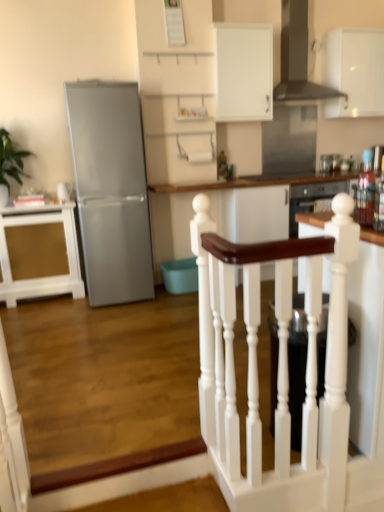
Question: Is the depth of white matte cabinet at upper center, positioned as the 2th cabinetry in left-to-right order, less than that of white matte cabinet at upper right, placed as the first cabinetry when sorted from top to bottom?

Choices:
 (A) yes
 (B) no

Answer: (A)

Question: Is white matte cabinet at upper center, which appears as the second cabinetry when ordered from the bottom, positioned far away from white matte cabinet at upper right, arranged as the third cabinetry when ordered from the bottom?

Choices:
 (A) no
 (B) yes

Answer: (A)

Question: From the image's perspective, does white matte cabinet at upper center, which appears as the second cabinetry when ordered from the bottom, appear higher than white matte cabinet at upper right, placed as the first cabinetry when sorted from right to left?

Choices:
 (A) yes
 (B) no

Answer: (B)

Question: From the image's perspective, does white matte cabinet at upper center, positioned as the 2th cabinetry in left-to-right order, appear lower than white matte cabinet at upper right, placed as the first cabinetry when sorted from right to left?

Choices:
 (A) yes
 (B) no

Answer: (A)

Question: Is white matte cabinet at upper center, marked as the 2th cabinetry in a top-to-bottom arrangement, facing towards white matte cabinet at upper right, which ranks as the 3th cabinetry in left-to-right order?

Choices:
 (A) yes
 (B) no

Answer: (B)

Question: Is white matte cabinet at upper center, which ranks as the second cabinetry in right-to-left order, at the left side of white matte cabinet at upper right, placed as the first cabinetry when sorted from top to bottom?

Choices:
 (A) yes
 (B) no

Answer: (A)

Question: Would you say stainless steel glass door at upper center is outside metallic stainless steel toaster at upper right, the 2th appliance in the left-to-right sequence?

Choices:
 (A) yes
 (B) no

Answer: (A)

Question: Is metallic stainless steel toaster at upper right, the first appliance from the back, inside stainless steel glass door at upper center?

Choices:
 (A) yes
 (B) no

Answer: (B)

Question: Is the surface of stainless steel glass door at upper center in direct contact with metallic stainless steel toaster at upper right, placed as the first appliance when sorted from right to left?

Choices:
 (A) no
 (B) yes

Answer: (A)

Question: Can you confirm if stainless steel glass door at upper center is positioned to the right of metallic stainless steel toaster at upper right, the 2th appliance positioned from the bottom?

Choices:
 (A) no
 (B) yes

Answer: (A)

Question: Is stainless steel glass door at upper center positioned behind metallic stainless steel toaster at upper right, the 2th appliance in the left-to-right sequence?

Choices:
 (A) yes
 (B) no

Answer: (B)

Question: Is stainless steel glass door at upper center at the left side of metallic stainless steel toaster at upper right, the 2th appliance in the left-to-right sequence?

Choices:
 (A) yes
 (B) no

Answer: (A)

Question: From the image's perspective, does white wood table at center appear lower than green leafy plant at left?

Choices:
 (A) no
 (B) yes

Answer: (B)